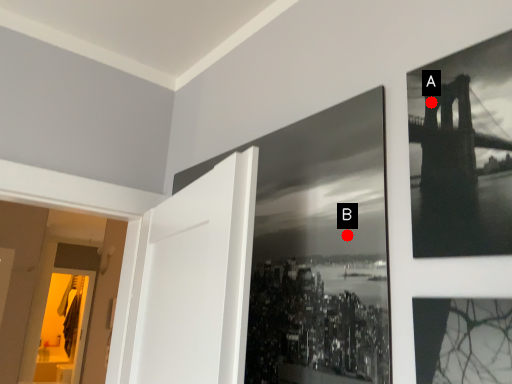
Question: Two points are circled on the image, labeled by A and B beside each circle. Which point appears closest to the camera in this image?

Choices:
 (A) A is closer
 (B) B is closer

Answer: (A)